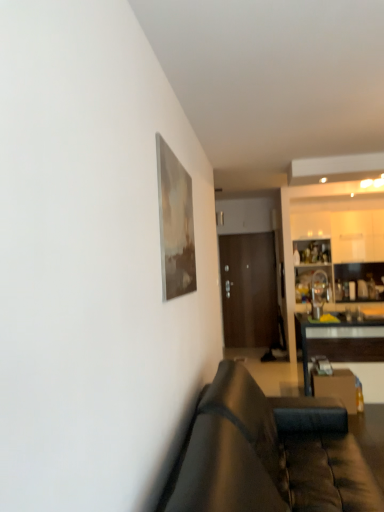
Question: Should I look upward or downward to see leather couch at lower right?

Choices:
 (A) down
 (B) up

Answer: (A)

Question: Would you say white glossy cabinetry at right is outside black glossy table at right?

Choices:
 (A) yes
 (B) no

Answer: (A)

Question: Is white glossy cabinetry at right at the left side of black glossy table at right?

Choices:
 (A) no
 (B) yes

Answer: (A)

Question: Is white glossy cabinetry at right bigger than black glossy table at right?

Choices:
 (A) yes
 (B) no

Answer: (B)

Question: From a real-world perspective, does white glossy cabinetry at right stand above black glossy table at right?

Choices:
 (A) no
 (B) yes

Answer: (B)

Question: Is white glossy cabinetry at right directly adjacent to black glossy table at right?

Choices:
 (A) no
 (B) yes

Answer: (A)

Question: Is white glossy cabinetry at right shorter than black glossy table at right?

Choices:
 (A) yes
 (B) no

Answer: (B)

Question: From the image's perspective, would you say brown wooden door at center is shown under leather couch at lower right?

Choices:
 (A) yes
 (B) no

Answer: (B)

Question: Does brown wooden door at center have a lesser width compared to leather couch at lower right?

Choices:
 (A) yes
 (B) no

Answer: (A)

Question: Considering the relative sizes of brown wooden door at center and leather couch at lower right in the image provided, is brown wooden door at center shorter than leather couch at lower right?

Choices:
 (A) yes
 (B) no

Answer: (B)

Question: Is brown wooden door at center outside leather couch at lower right?

Choices:
 (A) yes
 (B) no

Answer: (A)

Question: Considering the relative positions of brown wooden door at center and leather couch at lower right in the image provided, is brown wooden door at center behind leather couch at lower right?

Choices:
 (A) yes
 (B) no

Answer: (A)

Question: Is brown wooden door at center bigger than leather couch at lower right?

Choices:
 (A) no
 (B) yes

Answer: (A)

Question: Considering the relative positions of black glossy table at right and leather couch at lower right in the image provided, is black glossy table at right to the right of leather couch at lower right from the viewer's perspective?

Choices:
 (A) yes
 (B) no

Answer: (A)